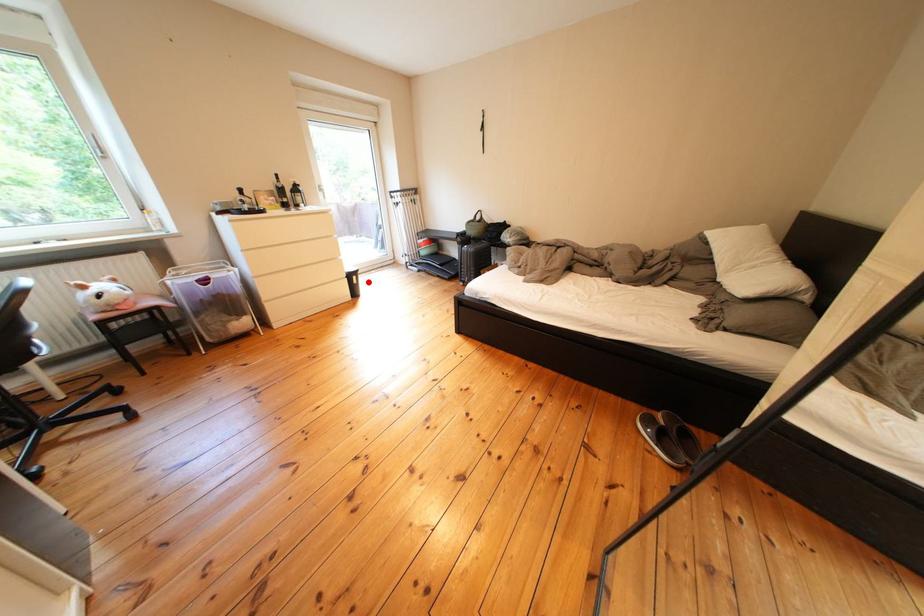
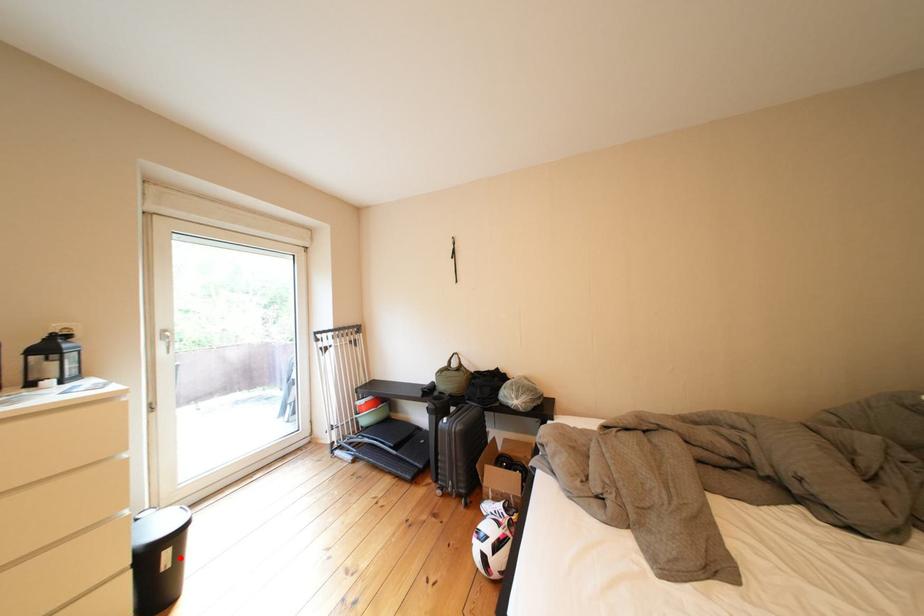
I am providing you with two images of the same scene from different viewpoints. A red point is marked on the first image and another point is marked on the second image. Do the highlighted points in image1 and image2 indicate the same real-world spot?

Yes